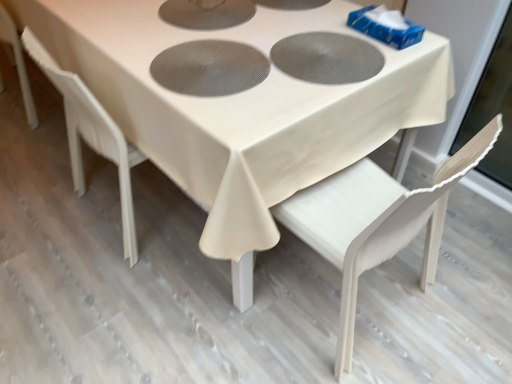
Locate an element on the screen. The height and width of the screenshot is (384, 512). vacant space to the left of white matte chair at lower right, acting as the second chair starting from the left is located at coordinates (195, 310).